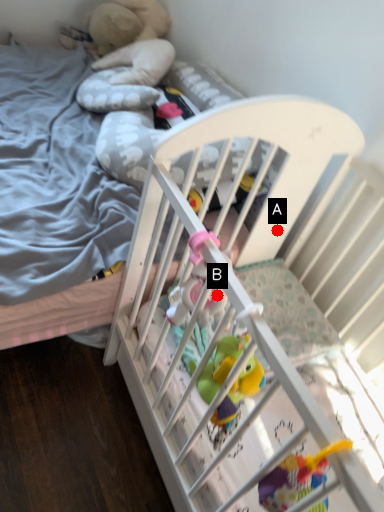
Question: Two points are circled on the image, labeled by A and B beside each circle. Which point is farther from the camera taking this photo?

Choices:
 (A) A is further
 (B) B is further

Answer: (A)